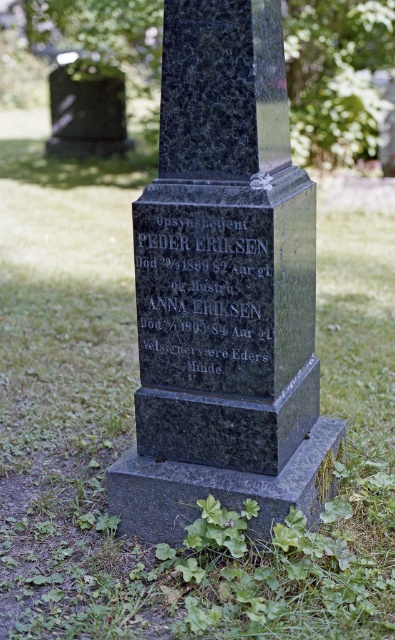
Which is behind, point (297, 422) or point (253, 260)?

The point (297, 422) is more distant.

Can you confirm if green polished stone monument at center is positioned above black granite stone at center?

Correct, green polished stone monument at center is located above black granite stone at center.

Is point (293, 180) closer to viewer compared to point (163, 205)?

No, (293, 180) is further to viewer.

This screenshot has width=395, height=640. I want to click on green polished stone monument at center, so click(223, 289).